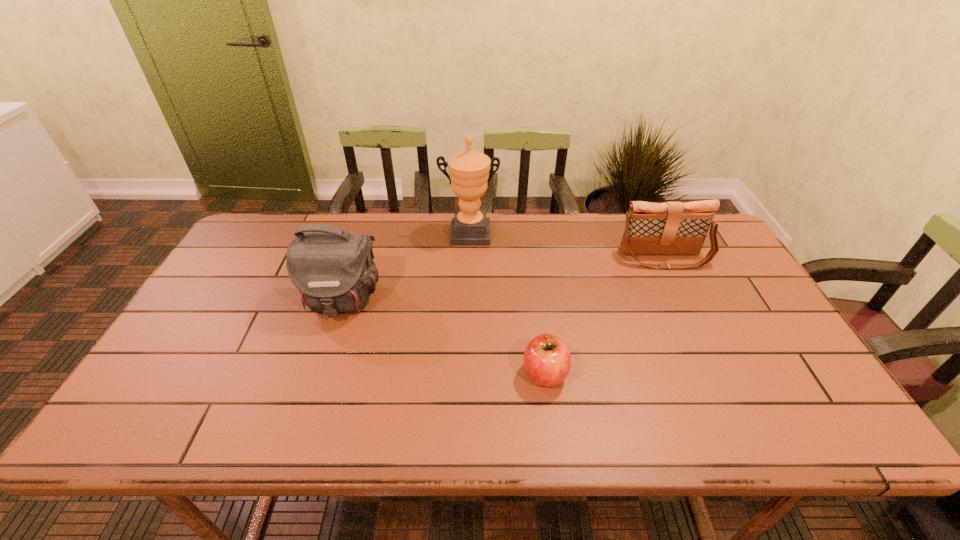
Identify the location of free space located on the front-facing side of the farther shoulder bag. This screenshot has height=540, width=960. (724, 382).

You are a GUI agent. You are given a task and a screenshot of the screen. Output one action in this format:
    pyautogui.click(x=<x>, y=<y>)
    Task: Click on the vacant point located 0.370m on the back of the apple
    
    Given the screenshot: What is the action you would take?
    pyautogui.click(x=530, y=260)

The height and width of the screenshot is (540, 960). Identify the location of award that is at the far edge. (469, 170).

Image resolution: width=960 pixels, height=540 pixels. In order to click on shoulder bag at the far edge in this screenshot , I will do `click(670, 228)`.

At what (x,y) coordinates should I click in order to perform the action: click on object that is positioned at the right edge. Please return your answer as a coordinate pair (x, y). Looking at the image, I should click on (670, 228).

Where is `object that is at the far right corner`? This screenshot has height=540, width=960. object that is at the far right corner is located at coordinates (670, 228).

This screenshot has width=960, height=540. In order to click on vacant space at the far edge of the desktop in this screenshot , I will do `click(445, 232)`.

Identify the location of blank space at the near edge of the desktop. pyautogui.click(x=676, y=413).

Identify the location of free space at the left edge of the desktop. Image resolution: width=960 pixels, height=540 pixels. (204, 390).

At what (x,y) coordinates should I click in order to perform the action: click on blank space at the right edge of the desktop. Please return your answer as a coordinate pair (x, y). This screenshot has width=960, height=540. Looking at the image, I should click on (797, 366).